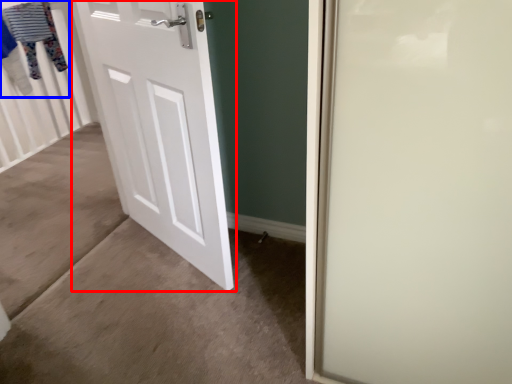
Question: Among these objects, which one is farthest to the camera, door (highlighted by a red box) or clothesline (highlighted by a blue box)?

Choices:
 (A) door
 (B) clothesline

Answer: (B)